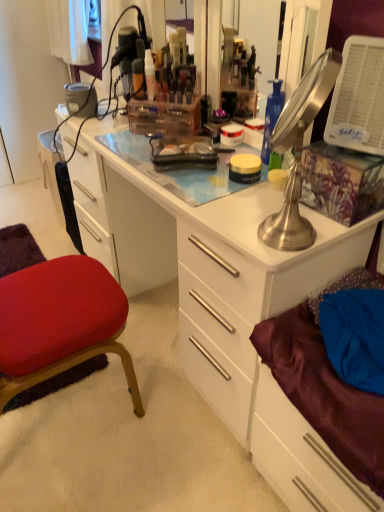
Find the location of a particular element. free space above white glossy desk at center (from a real-world perspective) is located at coordinates (192, 162).